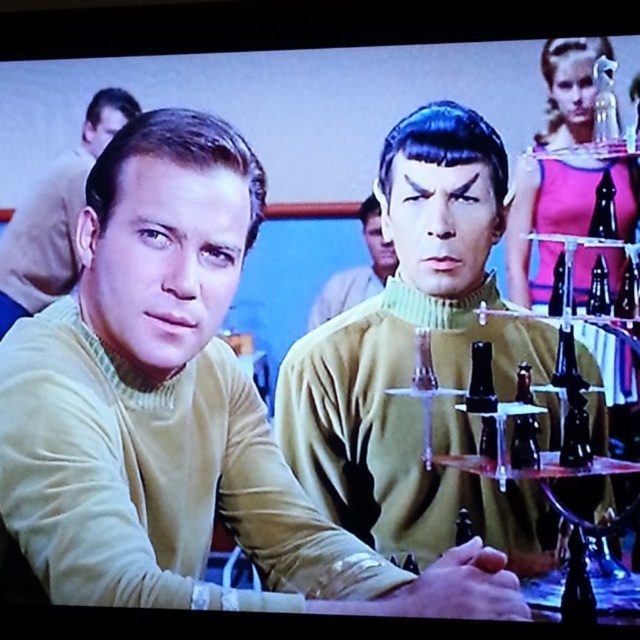
Is pink fabric dress at upper right closer to camera compared to green turtleneck sweater at center?

Yes, pink fabric dress at upper right is in front of green turtleneck sweater at center.

Between pink fabric dress at upper right and green turtleneck sweater at center, which one has more height?

Standing taller between the two is pink fabric dress at upper right.

Is point (516, 182) more distant than point (369, 221)?

No.

This screenshot has height=640, width=640. I want to click on pink fabric dress at upper right, so click(x=545, y=218).

Does pink fabric dress at upper right have a larger size compared to black glass bottle at right?

Yes.

Which is in front, point (556, 168) or point (564, 452)?

Point (564, 452) is more forward.

Is point (516, 173) closer to viewer compared to point (579, 449)?

No.

Identify the location of pink fabric dress at upper right. (545, 218).

Is clear glass bottle at center to the left of matte black bottle at center from the viewer's perspective?

Incorrect, clear glass bottle at center is not on the left side of matte black bottle at center.

Does clear glass bottle at center have a smaller size compared to matte black bottle at center?

No.

Who is more forward, (557, 262) or (467, 524)?

Point (557, 262)

You are a GUI agent. You are given a task and a screenshot of the screen. Output one action in this format:
    pyautogui.click(x=<x>, y=<y>)
    Task: Click on the clear glass bottle at center
    The width and height of the screenshot is (640, 640).
    Given the screenshot: What is the action you would take?
    pyautogui.click(x=557, y=285)